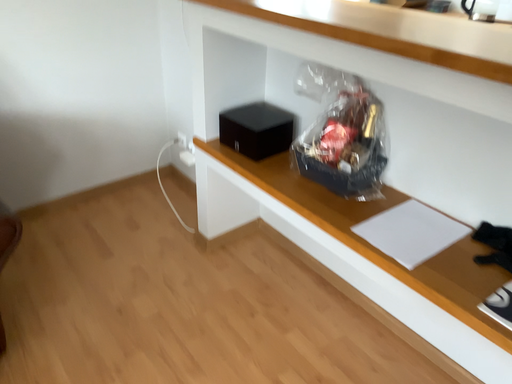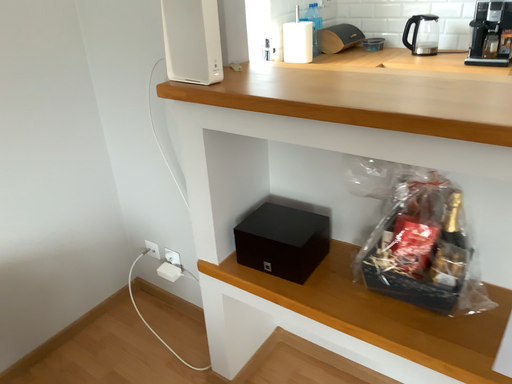
Question: Which way did the camera rotate in the video?

Choices:
 (A) rotated upward
 (B) rotated downward

Answer: (A)